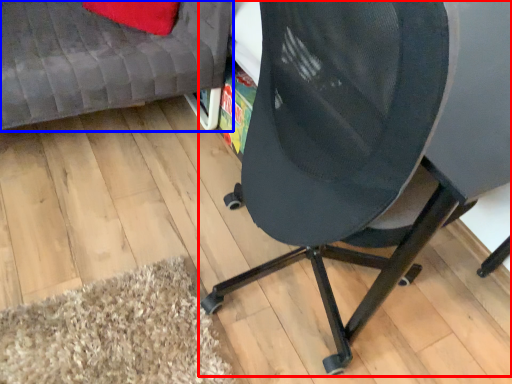
Question: Which point is closer to the camera, chair (highlighted by a red box) or furniture (highlighted by a blue box)?

Choices:
 (A) chair
 (B) furniture

Answer: (A)